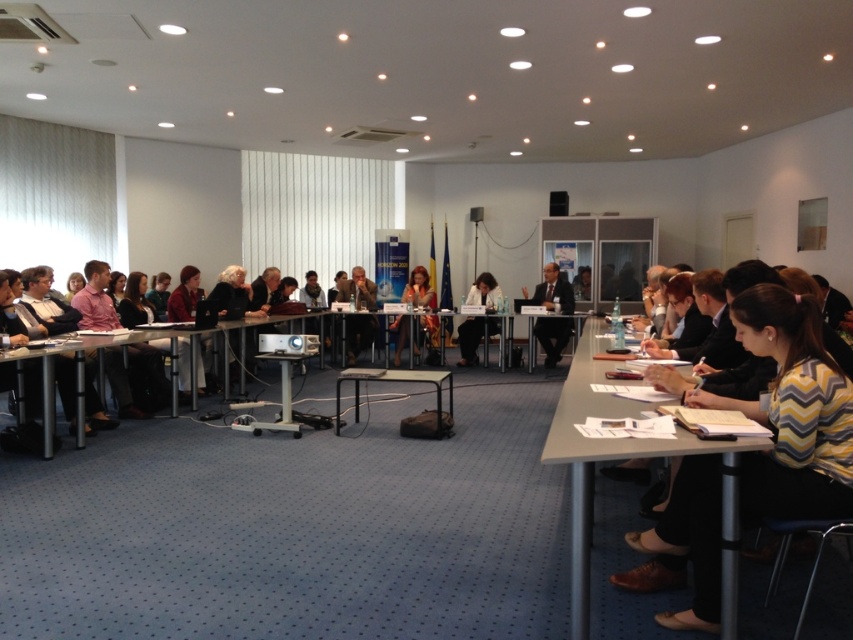
You are a photographer standing at the back of the room. You need to capture a clear photo of the dark suit at center without the metallic silver table at center blocking the view. Is this possible based on their heights?

Yes, since the dark suit at center is taller than the metallic silver table at center, the table won

You are a photographer positioned at the back of the room. You need to capture a clear photo of the dark suit at center without the striped sweater at lower right blocking it. Is this possible?

The striped sweater at lower right is in front of the dark suit at center, so it is blocking the view. To capture a clear photo of the dark suit at center without obstruction, you would need to adjust your angle or move closer to ensure the striped sweater at lower right is not in front.

You are a guest attending this meeting and need to sit down. You see the white plastic table at center and the matte black dress at center. Which object should you approach to find a seat?

You should approach the white plastic table at center to find a seat because it is positioned on the right side of the matte black dress at center, indicating it is part of the seating arrangement.